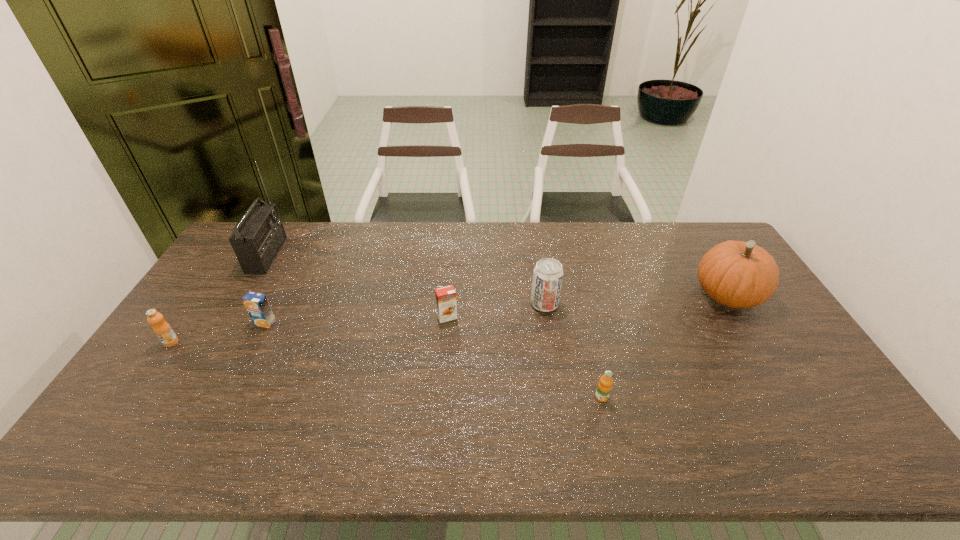
Find the location of `the second object from left to right`. the second object from left to right is located at coordinates (257, 238).

At what (x,y) coordinates should I click in order to perform the action: click on radio receiver. Please return your answer as a coordinate pair (x, y). The height and width of the screenshot is (540, 960). Looking at the image, I should click on (257, 238).

The image size is (960, 540). I want to click on pumpkin, so click(736, 274).

Find the location of a particular element. The width and height of the screenshot is (960, 540). the second tallest object is located at coordinates (736, 274).

Find the location of `the third object from right to left`. the third object from right to left is located at coordinates pos(548,274).

At what (x,y) coordinates should I click in order to perform the action: click on soda can. Please return your answer as a coordinate pair (x, y). The width and height of the screenshot is (960, 540). Looking at the image, I should click on (548, 274).

I want to click on the leftmost orange juice, so click(161, 328).

Where is `the leftmost object`? The image size is (960, 540). the leftmost object is located at coordinates (161, 328).

Where is `the fourth object from right to left`? the fourth object from right to left is located at coordinates (446, 304).

You are a GUI agent. You are given a task and a screenshot of the screen. Output one action in this format:
    pyautogui.click(x=<x>, y=<y>)
    Task: Click on the third object from left to right
    
    Given the screenshot: What is the action you would take?
    pyautogui.click(x=257, y=305)